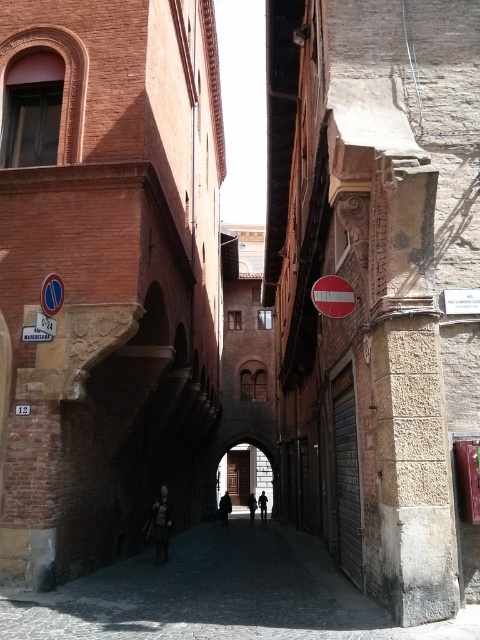
Does red plastic stop sign at center appear on the right side of dark gray fabric jacket at center?

Yes, red plastic stop sign at center is to the right of dark gray fabric jacket at center.

Which is below, red plastic stop sign at center or dark gray fabric jacket at center?

dark gray fabric jacket at center is below.

Locate an element on the screen. red plastic stop sign at center is located at coordinates (333, 296).

Which is below, red plastic stop sign at center or silhouette figure at center?

silhouette figure at center is below.

Between point (337, 312) and point (262, 499), which one is positioned in front?

Positioned in front is point (337, 312).

This screenshot has width=480, height=640. I want to click on red plastic stop sign at center, so click(x=333, y=296).

Is dark stone archway at center to the left of red plastic stop sign at center from the viewer's perspective?

Indeed, dark stone archway at center is positioned on the left side of red plastic stop sign at center.

Between point (228, 477) and point (335, 296), which one is positioned in front?

Point (335, 296)

Which is in front, point (252, 490) or point (323, 310)?

Positioned in front is point (323, 310).

You are a GUI agent. You are given a task and a screenshot of the screen. Output one action in this format:
    pyautogui.click(x=<x>, y=<y>)
    Task: Click on the dark stone archway at center
    This screenshot has height=640, width=480.
    Given the screenshot: What is the action you would take?
    coord(243,474)